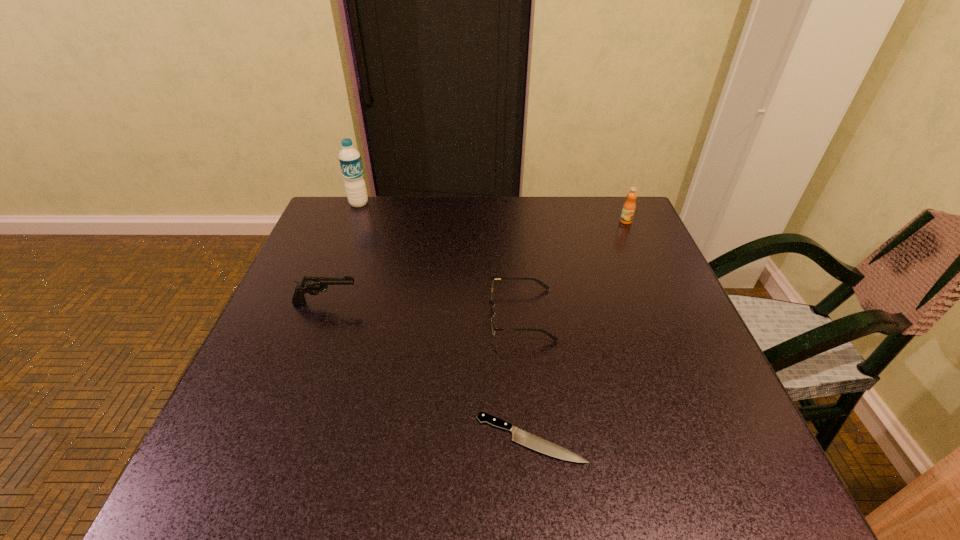
Locate an element on the screen. This screenshot has width=960, height=540. vacant space that's between the orange juice and the spectacles is located at coordinates (573, 268).

You are a GUI agent. You are given a task and a screenshot of the screen. Output one action in this format:
    pyautogui.click(x=<x>, y=<y>)
    Task: Click on the free space between the third tallest object and the rightmost object
    Image resolution: width=960 pixels, height=540 pixels.
    Given the screenshot: What is the action you would take?
    pyautogui.click(x=476, y=262)

Locate an element on the screen. This screenshot has height=540, width=960. vacant space in between the third shortest object and the spectacles is located at coordinates (423, 308).

I want to click on free spot between the farthest object and the third tallest object, so click(343, 253).

Locate an element on the screen. This screenshot has width=960, height=540. vacant region between the fourth tallest object and the orange juice is located at coordinates (573, 268).

The height and width of the screenshot is (540, 960). Find the location of `vacant area that lies between the second tallest object and the farthest object`. vacant area that lies between the second tallest object and the farthest object is located at coordinates (492, 212).

Image resolution: width=960 pixels, height=540 pixels. Find the location of `free space between the third shortest object and the tallest object`. free space between the third shortest object and the tallest object is located at coordinates (343, 253).

Locate an element on the screen. vacant area that lies between the nearest object and the fourth tallest object is located at coordinates (526, 376).

At what (x,y) coordinates should I click in order to perform the action: click on free area in between the second farthest object and the gun. Please return your answer as a coordinate pair (x, y). The width and height of the screenshot is (960, 540). Looking at the image, I should click on (476, 262).

Select which object appears as the third closest to the tallest object. Please provide its 2D coordinates. Your answer should be formatted as a tuple, i.e. [(x, y)], where the tuple contains the x and y coordinates of a point satisfying the conditions above.

[(629, 206)]